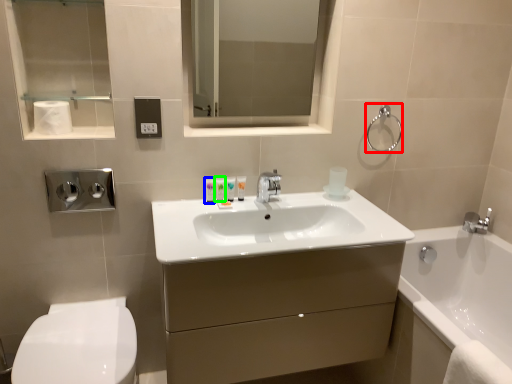
Question: Based on their relative distances, which object is farther from towel bar (highlighted by a red box)? Choose from toiletry (highlighted by a blue box) and toiletry (highlighted by a green box).

Choices:
 (A) toiletry
 (B) toiletry

Answer: (A)